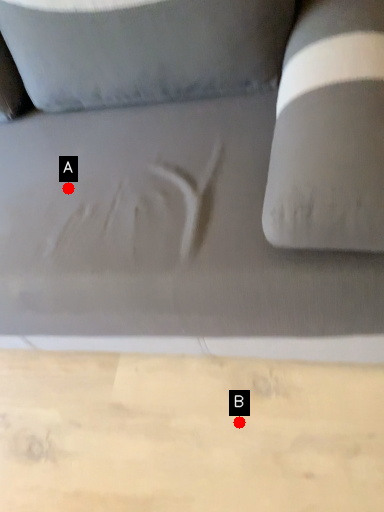
Question: Two points are circled on the image, labeled by A and B beside each circle. Which point appears farthest from the camera in this image?

Choices:
 (A) A is further
 (B) B is further

Answer: (B)